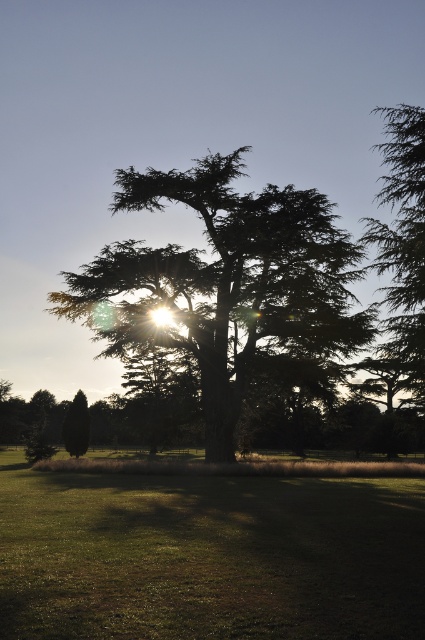
Can you confirm if green grassy field at center is taller than green needle-like tree at right?

In fact, green grassy field at center may be shorter than green needle-like tree at right.

Which of these two, green grassy field at center or green needle-like tree at right, stands shorter?

Standing shorter between the two is green grassy field at center.

What do you see at coordinates (209, 556) in the screenshot?
I see `green grassy field at center` at bounding box center [209, 556].

The image size is (425, 640). What are the coordinates of `green grassy field at center` in the screenshot? It's located at (209, 556).

Which is behind, point (51, 589) or point (186, 280)?

The point (186, 280) is more distant.

Which is more to the right, green grassy field at center or green textured tree at center?

From the viewer's perspective, green grassy field at center appears more on the right side.

Which is in front, point (257, 493) or point (192, 323)?

Point (257, 493) is in front.

I want to click on green grassy field at center, so [209, 556].

Is green textured tree at center thinner than green matte tree at lower left?

No, green textured tree at center is not thinner than green matte tree at lower left.

Between point (153, 301) and point (68, 451), which one is positioned in front?

Point (153, 301)

Measure the distance between green textured tree at center and camera.

green textured tree at center is 33.75 meters from camera.

What are the coordinates of `green textured tree at center` in the screenshot? It's located at (227, 282).